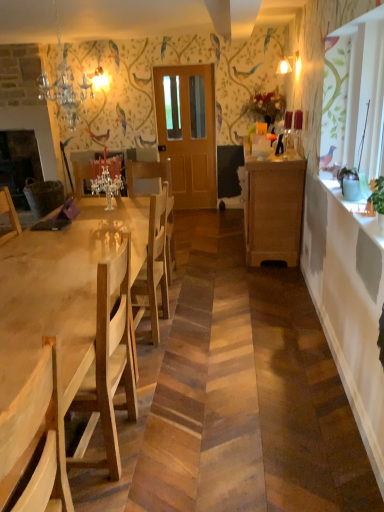
What are the coordinates of `free point above light wood table at center (from a real-world perspective)` in the screenshot? It's located at (64, 261).